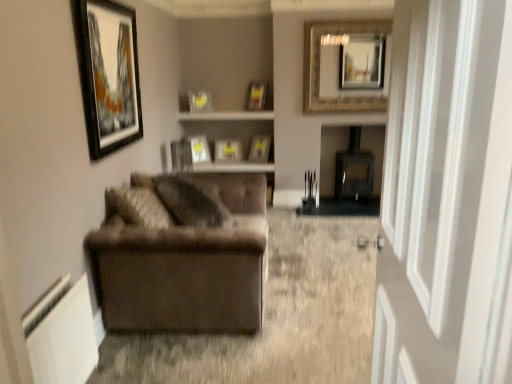
Question: Is transparent glass door at right located within matte glass picture frame at upper center, the 5th picture frame from the back?

Choices:
 (A) no
 (B) yes

Answer: (A)

Question: From a real-world perspective, is matte glass picture frame at upper center, the 4th picture frame positioned from the front, on transparent glass door at right?

Choices:
 (A) yes
 (B) no

Answer: (A)

Question: Does matte glass picture frame at upper center, the 4th picture frame positioned from the front, turn towards transparent glass door at right?

Choices:
 (A) yes
 (B) no

Answer: (B)

Question: From the image's perspective, is matte glass picture frame at upper center, the 4th picture frame positioned from the front, under transparent glass door at right?

Choices:
 (A) no
 (B) yes

Answer: (A)

Question: Is matte glass picture frame at upper center, the third picture frame in the right-to-left sequence, further to the viewer compared to transparent glass door at right?

Choices:
 (A) no
 (B) yes

Answer: (B)

Question: Does matte glass picture frame at upper center, the 5th picture frame from the back, have a lesser width compared to transparent glass door at right?

Choices:
 (A) yes
 (B) no

Answer: (A)

Question: Is gold-framed mirror at upper center, acting as the 1th picture frame starting from the right, wider than matte glass picture frame at upper center, the third picture frame in the right-to-left sequence?

Choices:
 (A) yes
 (B) no

Answer: (B)

Question: Is gold-framed mirror at upper center, acting as the sixth picture frame starting from the back, thinner than matte glass picture frame at upper center, the 4th picture frame positioned from the front?

Choices:
 (A) no
 (B) yes

Answer: (B)

Question: From the image's perspective, would you say gold-framed mirror at upper center, acting as the sixth picture frame starting from the back, is shown under matte glass picture frame at upper center, the 6th picture frame in the left-to-right sequence?

Choices:
 (A) yes
 (B) no

Answer: (B)

Question: Does gold-framed mirror at upper center, the third picture frame when ordered from front to back, touch matte glass picture frame at upper center, the 6th picture frame in the left-to-right sequence?

Choices:
 (A) yes
 (B) no

Answer: (B)

Question: Is matte glass picture frame at upper center, the 4th picture frame positioned from the front, inside gold-framed mirror at upper center, the third picture frame when ordered from front to back?

Choices:
 (A) yes
 (B) no

Answer: (B)

Question: Would you say gold-framed mirror at upper center, acting as the 1th picture frame starting from the right, is a long distance from matte glass picture frame at upper center, the 6th picture frame in the left-to-right sequence?

Choices:
 (A) no
 (B) yes

Answer: (A)

Question: Considering the relative sizes of black glossy picture frame at upper left, placed as the 8th picture frame when sorted from back to front, and matte black picture frame at center, the 7th picture frame viewed from the front, in the image provided, is black glossy picture frame at upper left, placed as the 8th picture frame when sorted from back to front, wider than matte black picture frame at center, the 7th picture frame viewed from the front,?

Choices:
 (A) yes
 (B) no

Answer: (B)